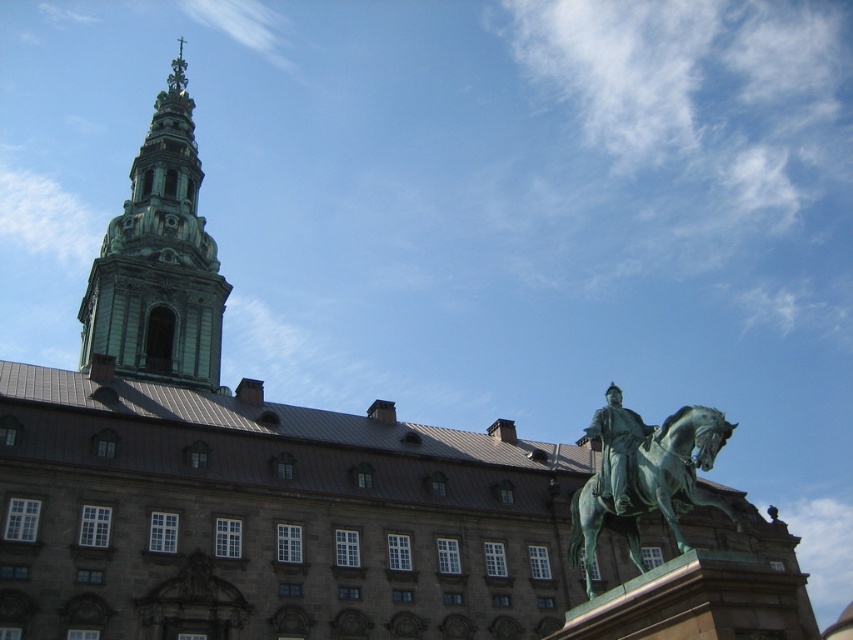
You are standing at a point 25 meters away from the point marked at coordinates [703,417] on the image. The scene shows a grand building with a tower and intricate details. Can you estimate how far you are from the base of the tower?

The point at coordinates [703,417] is 25.06 meters away from the viewer. Since this point is likely near the base of the tower, you are approximately 25 meters away from the base of the tower.

You are an architect assessing the building for maintenance. You notice both the green stone tower at upper left and the green polished bronze statue at right. Which one would require more material for a protective coating, considering their sizes?

The green stone tower at upper left requires more material for a protective coating because it has a larger size compared to the green polished bronze statue at right.

You are an architect designing a new sculpture garden. You have two items to place in the garden, the green stone tower at upper left and the green polished metal horse at center. Based on the image provided, which item requires more horizontal space for proper placement?

The green stone tower at upper left might be wider than the green polished metal horse at center, so it likely requires more horizontal space for proper placement.